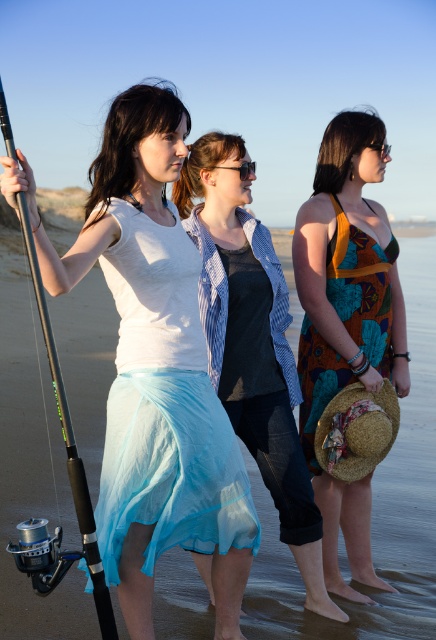
Looking at this image, you are a photographer trying to capture a clear shot of the matte white blouse at center and the multicolored printed fabric dress at center. Since both are at the center, which one is closer to the camera?

The matte white blouse at center is in front of the multicolored printed fabric dress at center, so it is closer to the camera.